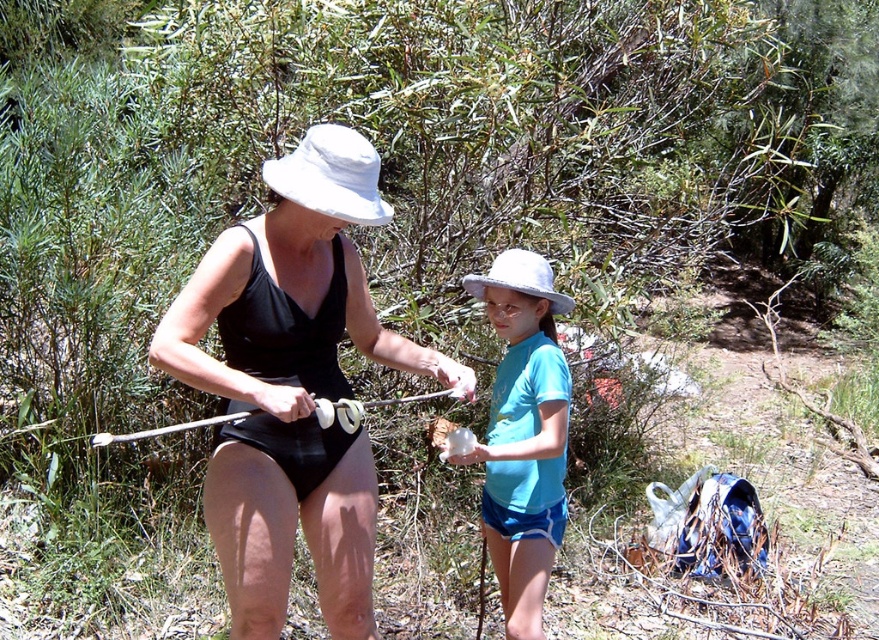
Question: Does black matte swimsuit at center appear under white fabric hat at upper center?

Choices:
 (A) no
 (B) yes

Answer: (B)

Question: Which point is farther to the camera?

Choices:
 (A) black matte swimsuit at center
 (B) white fabric hat at upper center
 (C) white matte hat at center

Answer: (C)

Question: Which object appears farthest from the camera in this image?

Choices:
 (A) white matte hat at center
 (B) white fabric hat at upper center
 (C) blue cotton shirt at center

Answer: (A)

Question: Is black matte swimsuit at center to the right of blue cotton shirt at center from the viewer's perspective?

Choices:
 (A) no
 (B) yes

Answer: (A)

Question: Which object is positioned farthest from the white matte hat at center?

Choices:
 (A) black matte swimsuit at center
 (B) blue cotton shirt at center

Answer: (A)

Question: In this image, where is blue cotton shirt at center located relative to white matte hat at center?

Choices:
 (A) above
 (B) below

Answer: (B)